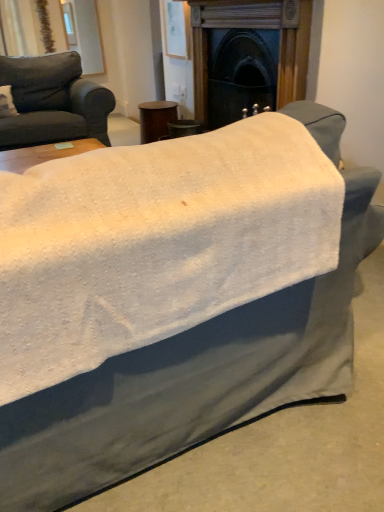
Question: Is dark wood fireplace at center inside the boundaries of matte gray couch at left, or outside?

Choices:
 (A) outside
 (B) inside

Answer: (A)

Question: Considering their positions, is dark wood fireplace at center located in front of or behind matte gray couch at left?

Choices:
 (A) front
 (B) behind

Answer: (A)

Question: Which is nearer to the brown wood side table at center?

Choices:
 (A) matte gray couch at left
 (B) dark wood fireplace at center

Answer: (A)

Question: Which of these objects is positioned closest to the dark wood fireplace at center?

Choices:
 (A) brown wood side table at center
 (B) matte gray couch at left

Answer: (A)